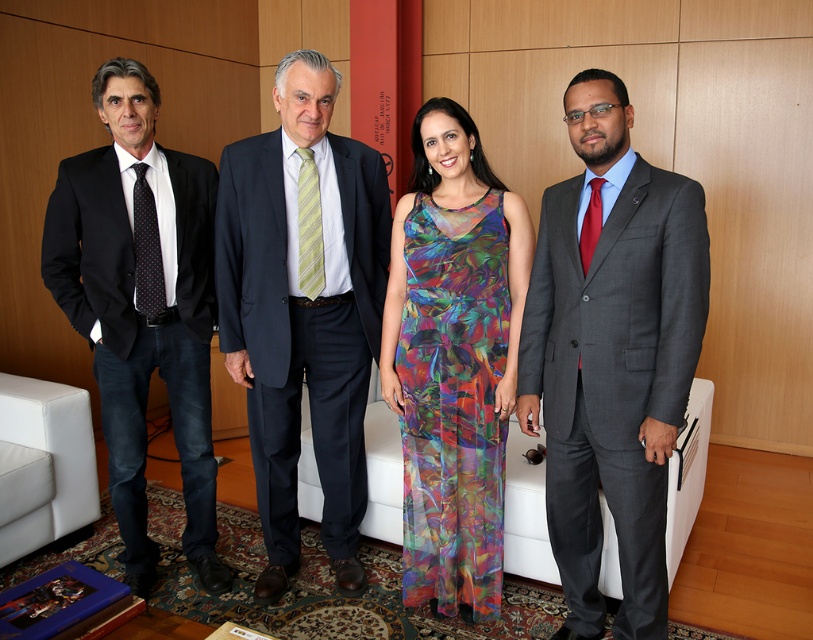
Does dark blue suit at center have a lesser width compared to multicolored chiffon dress at center?

Incorrect, dark blue suit at center's width is not less than multicolored chiffon dress at center's.

Is dark blue suit at center smaller than multicolored chiffon dress at center?

No.

Identify the location of dark blue suit at center. This screenshot has width=813, height=640. (303, 308).

Where is `dark blue suit at center`? dark blue suit at center is located at coordinates (303, 308).

Between gray suit at right and dark blue suit at center, which one has less height?

gray suit at right is shorter.

The height and width of the screenshot is (640, 813). Describe the element at coordinates (611, 355) in the screenshot. I see `gray suit at right` at that location.

The image size is (813, 640). What are the coordinates of `gray suit at right` in the screenshot? It's located at (611, 355).

Which is behind, point (280, 460) or point (133, 385)?

Positioned behind is point (280, 460).

Between dark blue suit at center and matte black suit at left, which one appears on the right side from the viewer's perspective?

dark blue suit at center

The height and width of the screenshot is (640, 813). What do you see at coordinates (303, 308) in the screenshot?
I see `dark blue suit at center` at bounding box center [303, 308].

I want to click on dark blue suit at center, so click(303, 308).